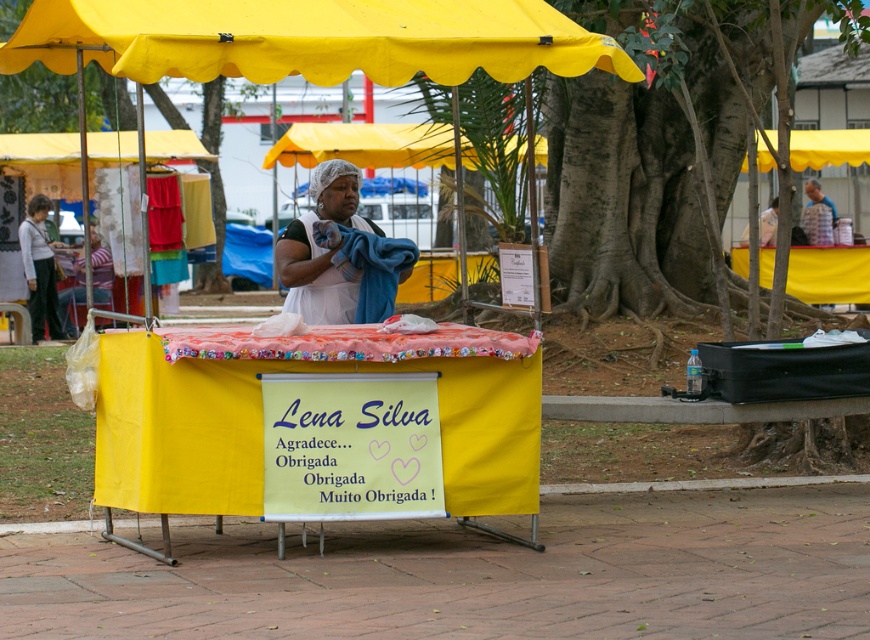
Question: Based on their relative distances, which object is nearer to the matte gray sweater at left?

Choices:
 (A) yellow fabric canopy at upper center
 (B) yellow fabric canopy at upper right
 (C) white fabric at center
 (D) yellow fabric canopy at upper left

Answer: (D)

Question: Which point is closer to the camera?

Choices:
 (A) coord(275,10)
 (B) coord(372,237)

Answer: (A)

Question: Can you confirm if white fabric at center is wider than yellow fabric canopy at upper right?

Choices:
 (A) no
 (B) yes

Answer: (B)

Question: Does yellow fabric canopy at upper center have a lesser width compared to blue fabric bag at upper right?

Choices:
 (A) no
 (B) yes

Answer: (A)

Question: Can you confirm if yellow fabric canopy at upper center is thinner than white fabric at center?

Choices:
 (A) yes
 (B) no

Answer: (B)

Question: Considering the real-world distances, which object is closest to the white fabric at center?

Choices:
 (A) yellow fabric canopy at upper center
 (B) yellow fabric canopy at upper left
 (C) yellow fabric canopy at upper right
 (D) blue fabric bag at upper right

Answer: (A)